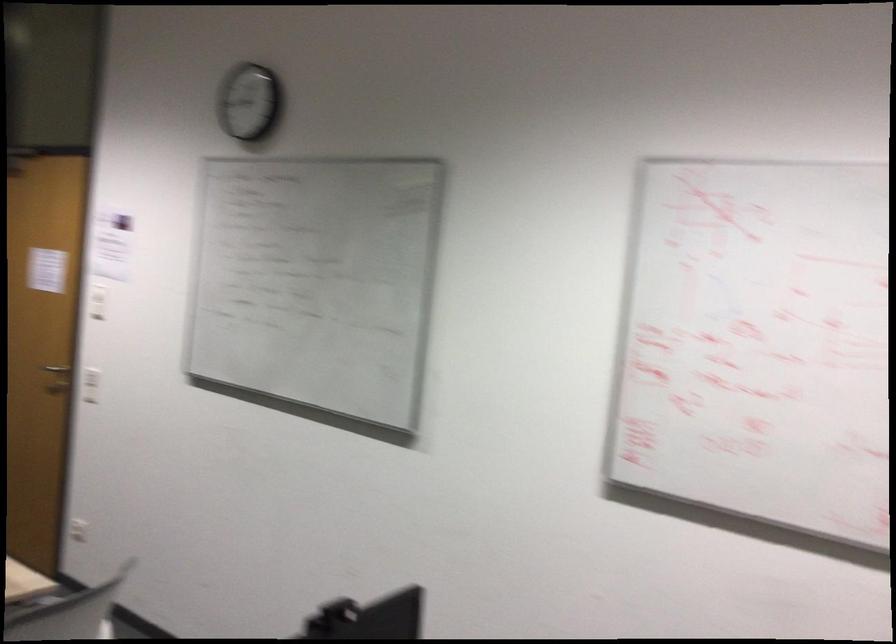
Locate an element on the screen. Image resolution: width=896 pixels, height=644 pixels. silver door handle is located at coordinates (56, 368).